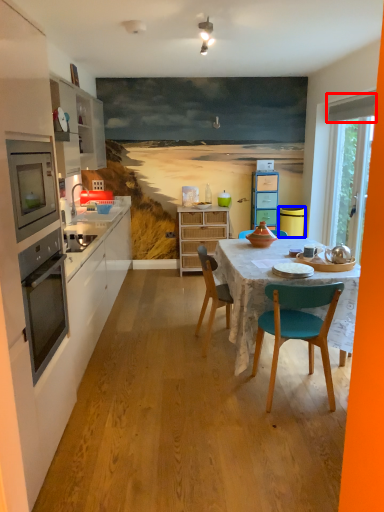
Question: Which point is further to the camera, exhaust hood (highlighted by a red box) or trash bin/can (highlighted by a blue box)?

Choices:
 (A) exhaust hood
 (B) trash bin/can

Answer: (B)